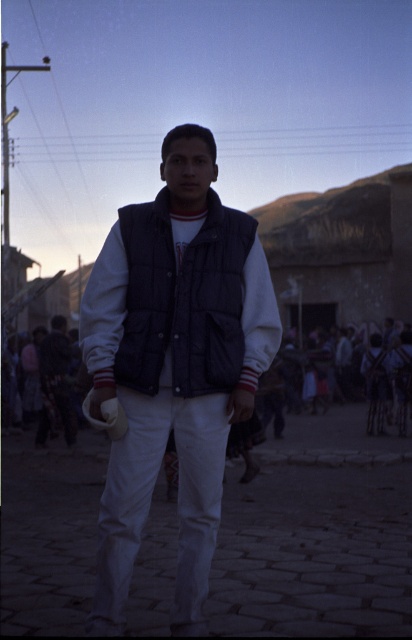
Please describe the location of the white cotton crowd at center in the image using coordinate points.

The white cotton crowd at center is located at coordinate point (336, 432).

You are a photographer trying to capture a photo of the white cotton crowd at center and the dark blue denim vest at center. Based on their sizes in the image, which object would appear larger in your photo?

The white cotton crowd at center would appear larger in the photo since its width surpasses that of the dark blue denim vest at center.